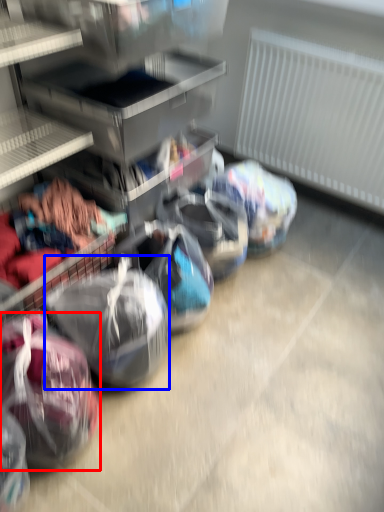
Question: Among these objects, which one is farthest to the camera, sack (highlighted by a red box) or sack (highlighted by a blue box)?

Choices:
 (A) sack
 (B) sack

Answer: (B)